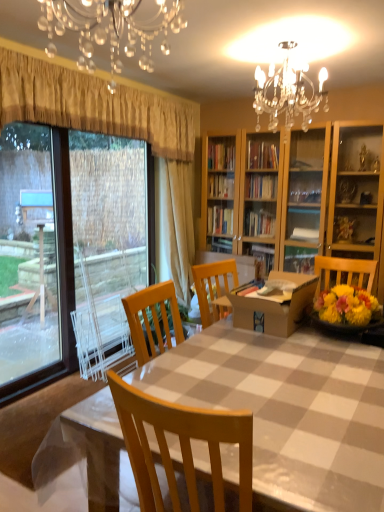
I want to click on empty space that is ontop of checkered plastic table at center, so click(x=284, y=372).